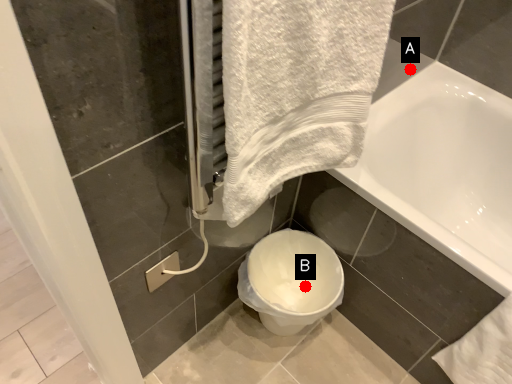
Question: Two points are circled on the image, labeled by A and B beside each circle. Among these points, which one is nearest to the camera?

Choices:
 (A) A is closer
 (B) B is closer

Answer: (A)